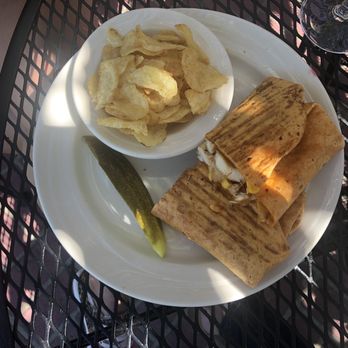
The image size is (348, 348). I want to click on bowl, so click(x=209, y=122).